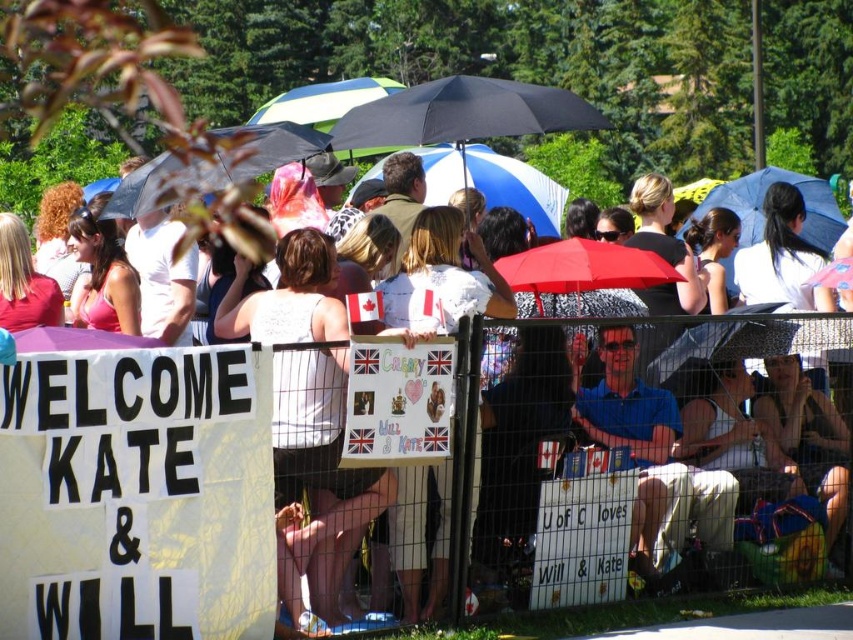
You are a photographer trying to capture a clear shot of the white paper sign at center and the black matte umbrella at center from your current position. Can you see both objects fully without any obstruction?

The white paper sign at center is in front of the black matte umbrella at center, so the sign will block part of the umbrella. Therefore, you cannot see both objects fully without any obstruction.

From the picture: You are organizing a surprise party and need to place decorations. You have a white paper sign at center and a blue fabric umbrella at upper right. Which decoration is smaller in size?

The white paper sign at center is smaller compared to the blue fabric umbrella at upper right.